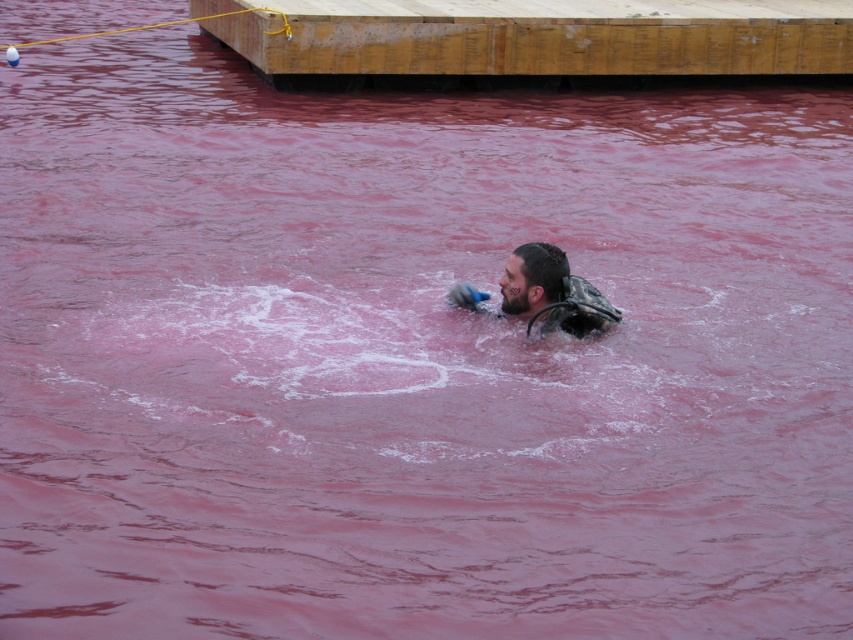
Does wooden dock at upper center appear on the right side of camouflage fabric life jacket at center?

Incorrect, wooden dock at upper center is not on the right side of camouflage fabric life jacket at center.

Is point (844, 61) less distant than point (607, 316)?

That is False.

I want to click on wooden dock at upper center, so point(537,36).

At what (x,y) coordinates should I click in order to perform the action: click on camouflage fabric at center. Please return your answer as a coordinate pair (x, y). The width and height of the screenshot is (853, 640). Looking at the image, I should click on (552, 292).

The width and height of the screenshot is (853, 640). Describe the element at coordinates (537, 36) in the screenshot. I see `wooden dock at upper center` at that location.

Identify the location of wooden dock at upper center. (537, 36).

In order to click on wooden dock at upper center in this screenshot , I will do `click(537, 36)`.